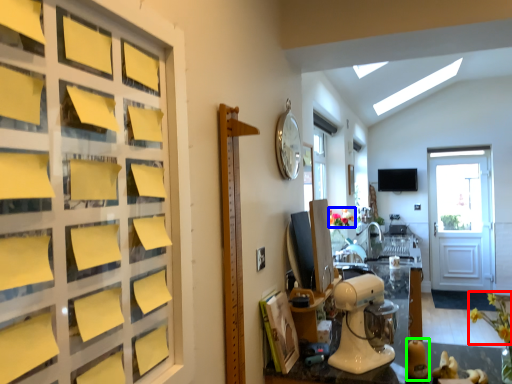
Question: Considering the real-world distances, which object is farthest from flower (highlighted by a red box)? flower (highlighted by a blue box) or toy (highlighted by a green box)?

Choices:
 (A) flower
 (B) toy

Answer: (A)